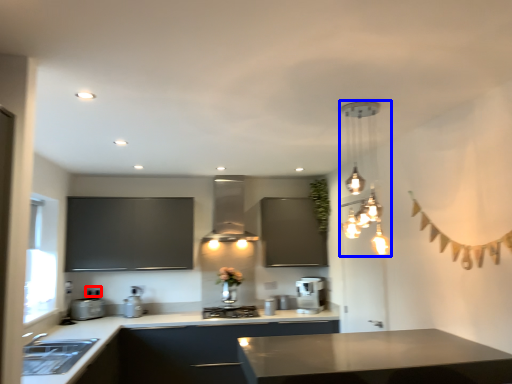
Question: Which object is further to the camera taking this photo, electric outlet (highlighted by a red box) or lamp (highlighted by a blue box)?

Choices:
 (A) electric outlet
 (B) lamp

Answer: (A)